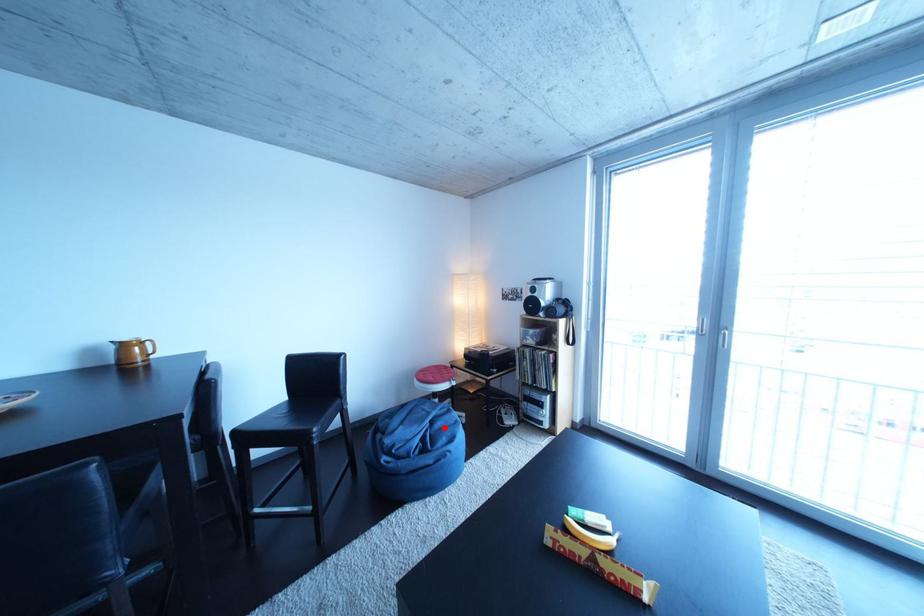
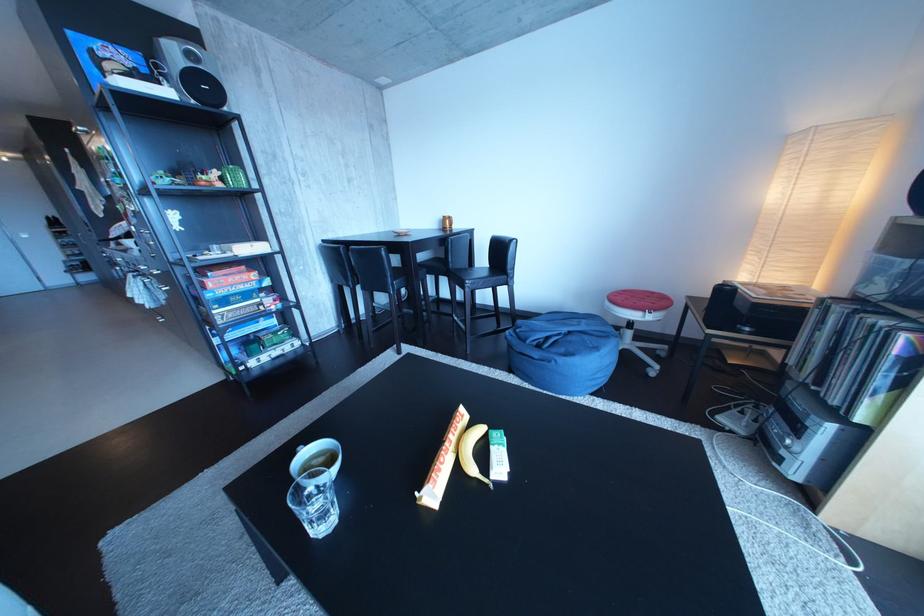
Question: I am providing you with two images of the same scene from different viewpoints. A red point is shown in image1. For the corresponding object point in image2, is it positioned nearer or farther from the camera?

Choices:
 (A) Nearer
 (B) Farther

Answer: (B)